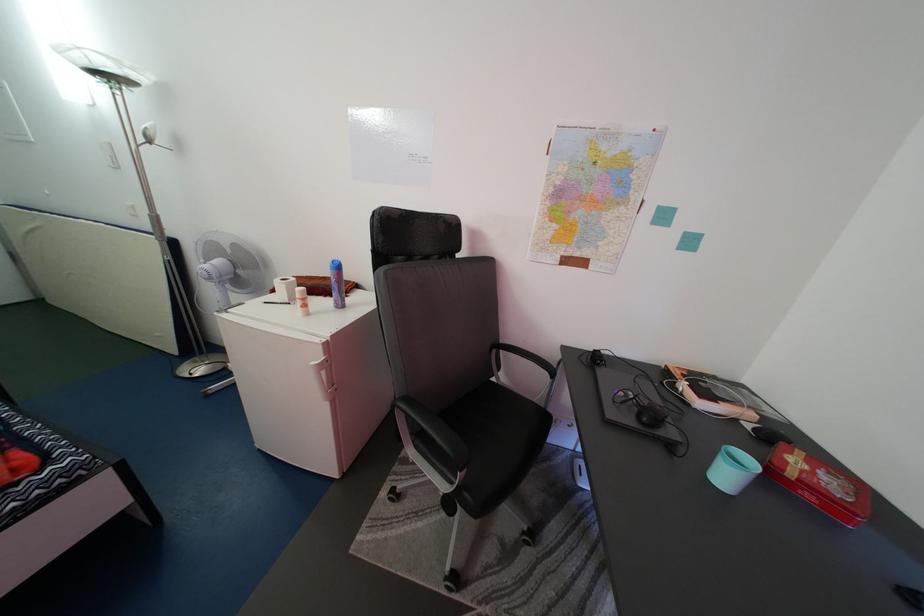
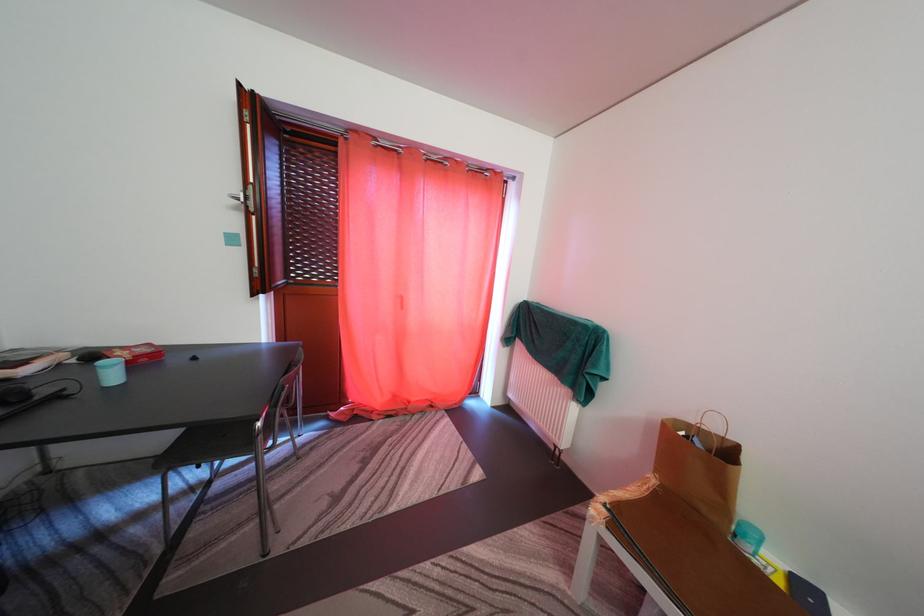
The point at (803, 467) is marked in the first image. Where is the corresponding point in the second image?

(128, 360)